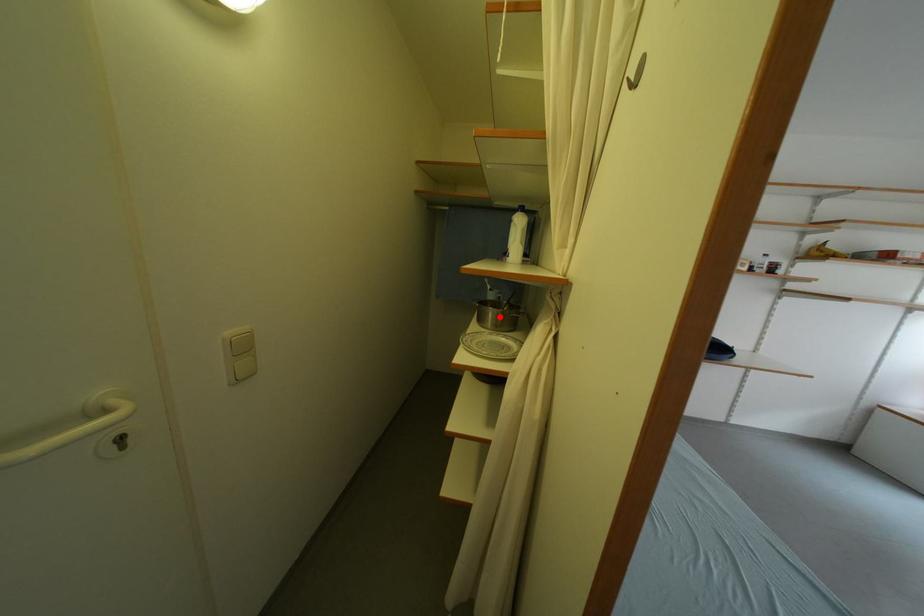
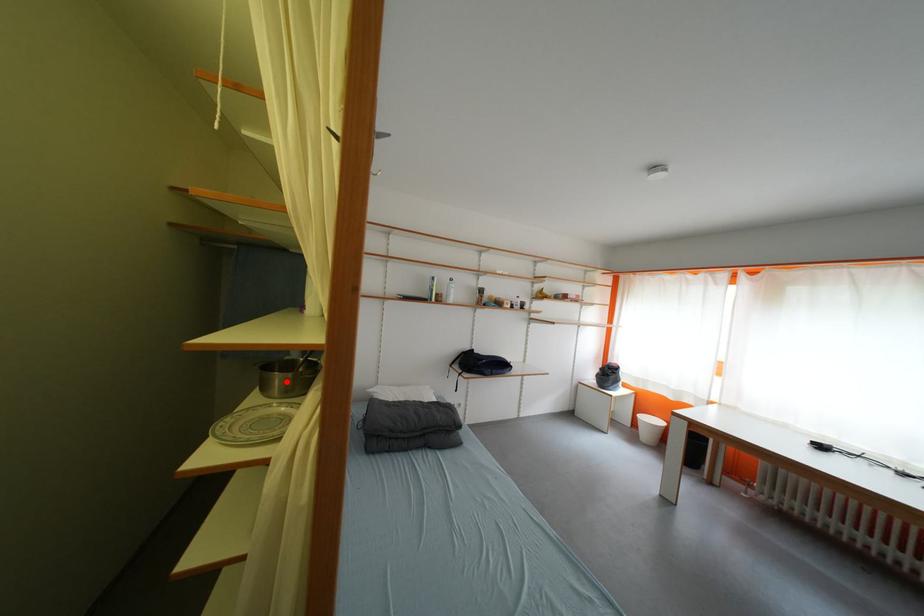
I am providing you with two images of the same scene from different viewpoints. A red point is marked on the first image and another point is marked on the second image. Do the highlighted points in image1 and image2 indicate the same real-world spot?

Yes